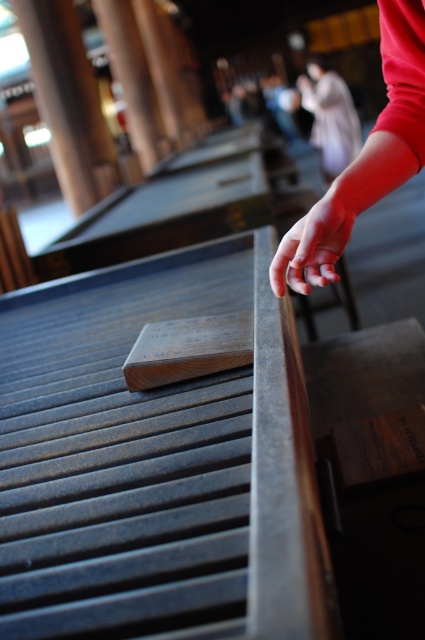
Which of these two, smooth red arm at upper right or smooth red hand at upper right, stands shorter?

smooth red hand at upper right

Which is in front, point (387, 150) or point (306, 241)?

Positioned in front is point (306, 241).

Does point (285, 276) come closer to viewer compared to point (323, 204)?

No, (285, 276) is behind (323, 204).

Find the location of a particular element. Image resolution: width=425 pixels, height=640 pixels. smooth red arm at upper right is located at coordinates (365, 157).

Which is more to the right, smooth red hand at upper right or smooth beige robe at upper center?

Positioned to the right is smooth beige robe at upper center.

Between smooth red hand at upper right and smooth beige robe at upper center, which one appears on the left side from the viewer's perspective?

From the viewer's perspective, smooth red hand at upper right appears more on the left side.

Does point (317, 237) come behind point (316, 76)?

That is False.

This screenshot has width=425, height=640. I want to click on smooth red hand at upper right, so click(x=311, y=246).

Describe the element at coordinates (68, 100) in the screenshot. I see `smooth brown wood at upper left` at that location.

Does point (62, 51) lie behind point (285, 243)?

Yes, it is.

Where is `smooth brown wood at upper left`? The image size is (425, 640). smooth brown wood at upper left is located at coordinates (68, 100).